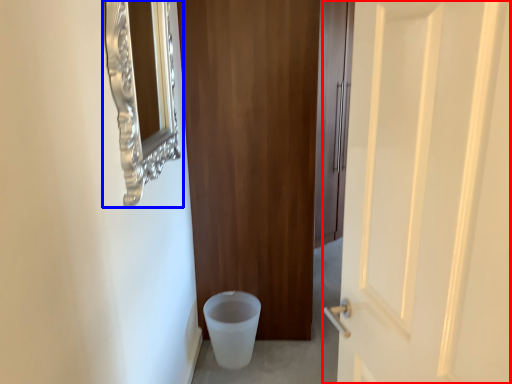
Question: Among these objects, which one is nearest to the camera, door (highlighted by a red box) or medicine cabinet (highlighted by a blue box)?

Choices:
 (A) door
 (B) medicine cabinet

Answer: (A)